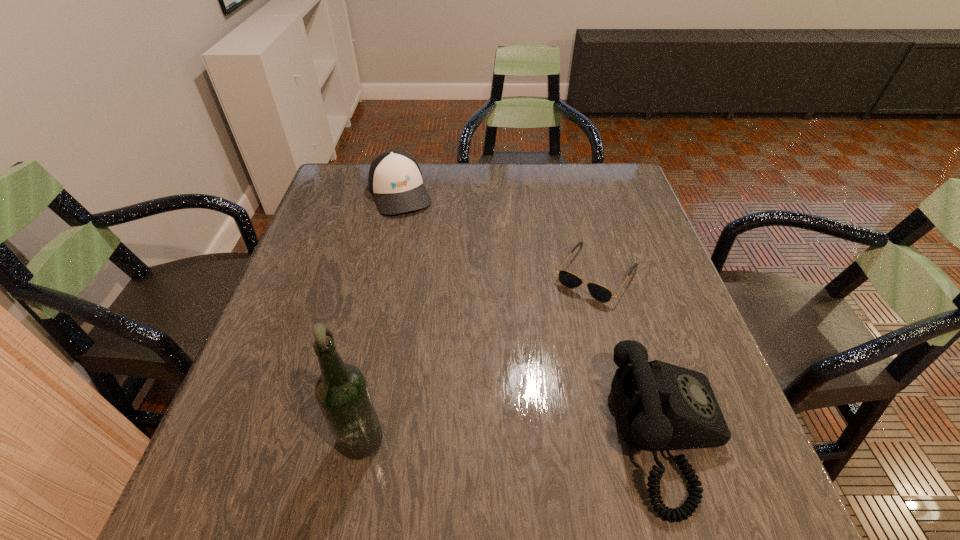
Find the location of a particular element. The image size is (960, 540). free spot between the beer bottle and the telephone is located at coordinates (516, 435).

At what (x,y) coordinates should I click in order to perform the action: click on blank region between the tallest object and the cap. Please return your answer as a coordinate pair (x, y). The image size is (960, 540). Looking at the image, I should click on (382, 313).

Identify which object is the nearest to the tallest object. Please provide its 2D coordinates. Your answer should be formatted as a tuple, i.e. [(x, y)], where the tuple contains the x and y coordinates of a point satisfying the conditions above.

[(661, 406)]

Locate an element on the screen. object that stands as the closest to the tallest object is located at coordinates (661, 406).

Where is `vacant space that satisfies the following two spatial constraints: 1. on the front side of the farthest object; 2. on the right side of the second farthest object`? The image size is (960, 540). vacant space that satisfies the following two spatial constraints: 1. on the front side of the farthest object; 2. on the right side of the second farthest object is located at coordinates (383, 273).

Locate an element on the screen. Image resolution: width=960 pixels, height=540 pixels. free spot that satisfies the following two spatial constraints: 1. on the front side of the sunglasses; 2. on the dial of the telephone is located at coordinates (639, 436).

The image size is (960, 540). In order to click on free location that satisfies the following two spatial constraints: 1. on the front side of the shortest object; 2. on the dial of the telephone in this screenshot , I will do `click(639, 436)`.

You are a GUI agent. You are given a task and a screenshot of the screen. Output one action in this format:
    pyautogui.click(x=<x>, y=<y>)
    Task: Click on the vacant space that satisfies the following two spatial constraints: 1. on the front side of the cap; 2. on the left side of the beer bottle
    
    Given the screenshot: What is the action you would take?
    pyautogui.click(x=348, y=433)